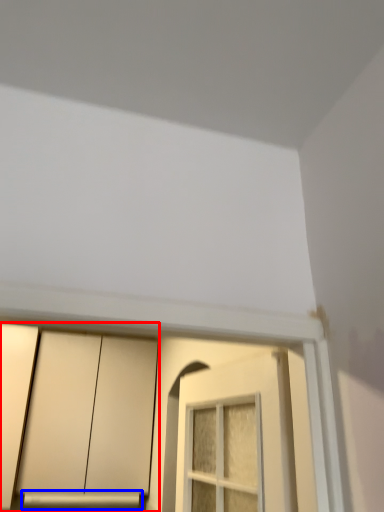
Question: Which of the following is the closest to the observer, cabinetry (highlighted by a red box) or window sill (highlighted by a blue box)?

Choices:
 (A) cabinetry
 (B) window sill

Answer: (A)